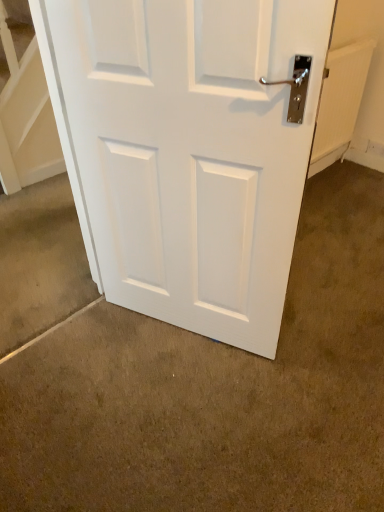
Question: From the image's perspective, is white matte door at center located above white matte door at center?

Choices:
 (A) no
 (B) yes

Answer: (A)

Question: Can you confirm if white matte door at center is positioned to the left of white matte door at center?

Choices:
 (A) yes
 (B) no

Answer: (B)

Question: Could you tell me if white matte door at center is facing white matte door at center?

Choices:
 (A) no
 (B) yes

Answer: (A)

Question: Does white matte door at center have a larger size compared to white matte door at center?

Choices:
 (A) yes
 (B) no

Answer: (A)

Question: Is white matte door at center located outside white matte door at center?

Choices:
 (A) yes
 (B) no

Answer: (A)

Question: Is white matte door at center located within white matte door at center?

Choices:
 (A) yes
 (B) no

Answer: (B)

Question: Is white matte door at center thinner than white matte door at center?

Choices:
 (A) yes
 (B) no

Answer: (A)

Question: Is white matte door at center not near white matte door at center?

Choices:
 (A) no
 (B) yes

Answer: (A)

Question: Is white matte door at center surrounded by white matte door at center?

Choices:
 (A) no
 (B) yes

Answer: (A)

Question: Is white matte door at center wider than white matte door at center?

Choices:
 (A) yes
 (B) no

Answer: (B)

Question: From the image's perspective, does white matte door at center appear lower than white matte door at center?

Choices:
 (A) no
 (B) yes

Answer: (A)

Question: Is white matte door at center positioned in front of white matte door at center?

Choices:
 (A) no
 (B) yes

Answer: (A)

Question: Considering their positions, is white matte door at center located in front of or behind white matte door at center?

Choices:
 (A) front
 (B) behind

Answer: (B)